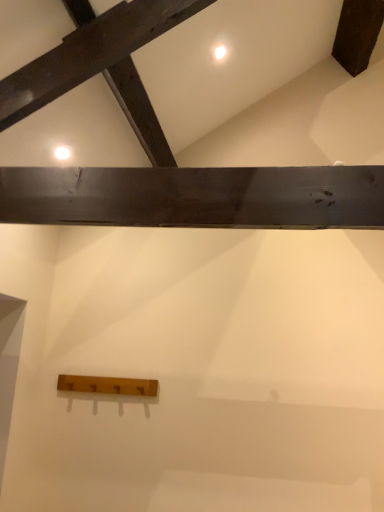
What do you see at coordinates (108, 385) in the screenshot? I see `wooden plank at lower center` at bounding box center [108, 385].

Identify the location of wooden plank at lower center. This screenshot has width=384, height=512. [x=108, y=385].

Image resolution: width=384 pixels, height=512 pixels. Find the location of `wooden plank at lower center`. wooden plank at lower center is located at coordinates (108, 385).